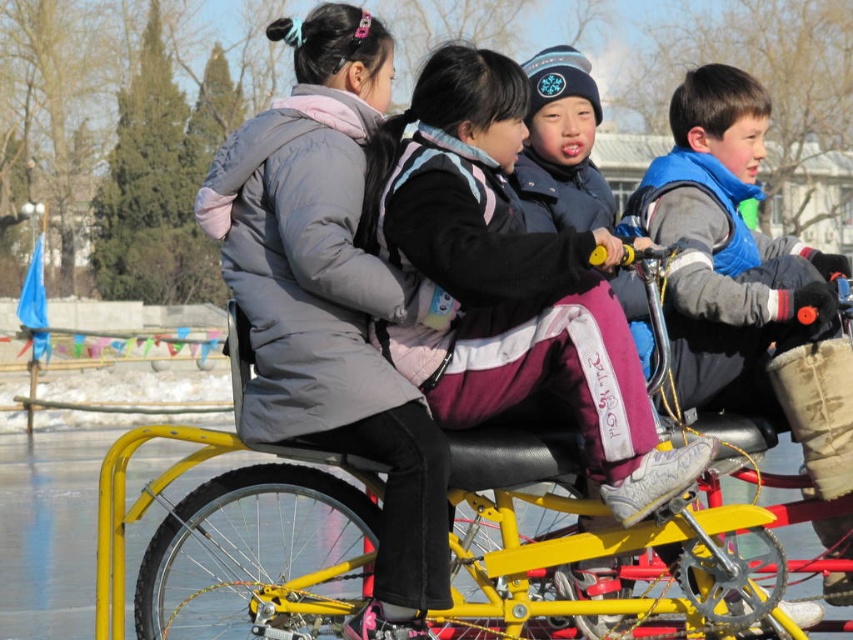
Question: Is yellow metallic tricycle at center closer to the viewer compared to blue fleece vest at right?

Choices:
 (A) yes
 (B) no

Answer: (A)

Question: Does gray down jacket at center have a lesser width compared to yellow metallic tricycle at center?

Choices:
 (A) no
 (B) yes

Answer: (B)

Question: Considering the real-world distances, which object is closest to the blue fleece vest at right?

Choices:
 (A) gray down jacket at center
 (B) matte black jacket at center
 (C) yellow metallic tricycle at center

Answer: (B)

Question: Which object is positioned farthest from the gray down jacket at center?

Choices:
 (A) yellow metallic tricycle at center
 (B) blue fleece vest at right
 (C) matte black jacket at center
 (D) purple fleece jacket at center

Answer: (A)

Question: Is gray down jacket at center bigger than yellow metallic tricycle at center?

Choices:
 (A) yes
 (B) no

Answer: (B)

Question: Which object is closer to the camera taking this photo?

Choices:
 (A) purple fleece jacket at center
 (B) yellow metallic tricycle at center
 (C) matte black jacket at center

Answer: (A)